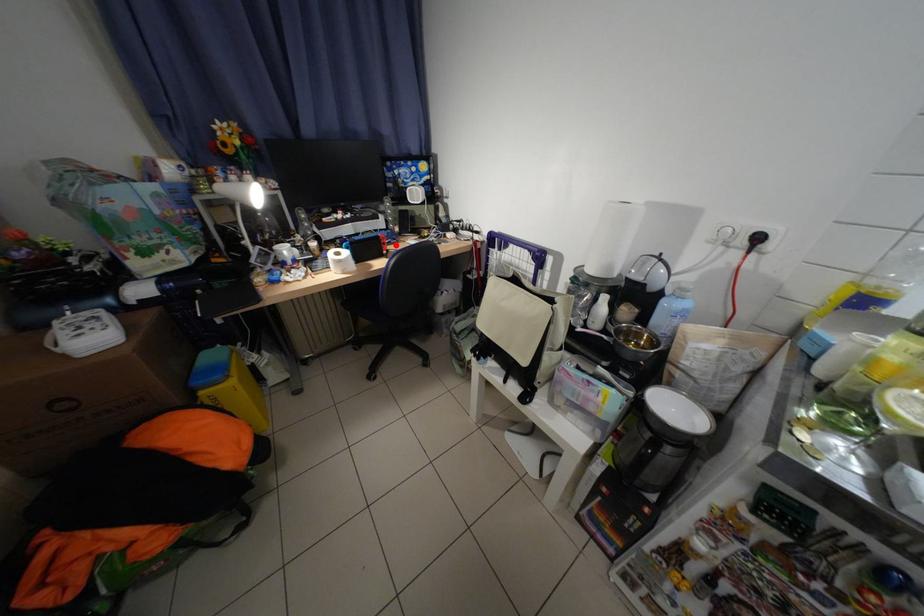
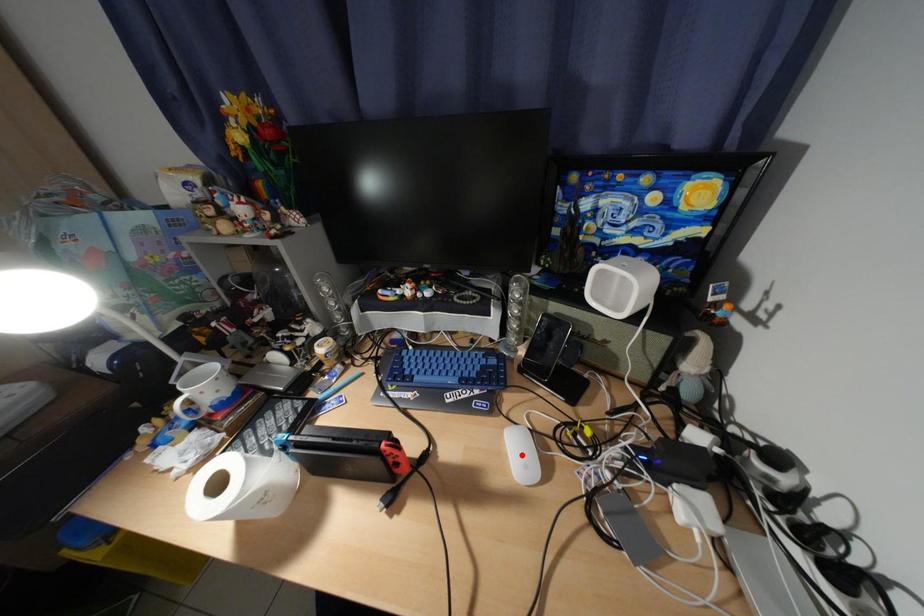
I am providing you with two images of the same scene from different viewpoints. A red point is marked on the first image and another point is marked on the second image. Does the point marked in image1 correspond to the same location as the one in image2?

No